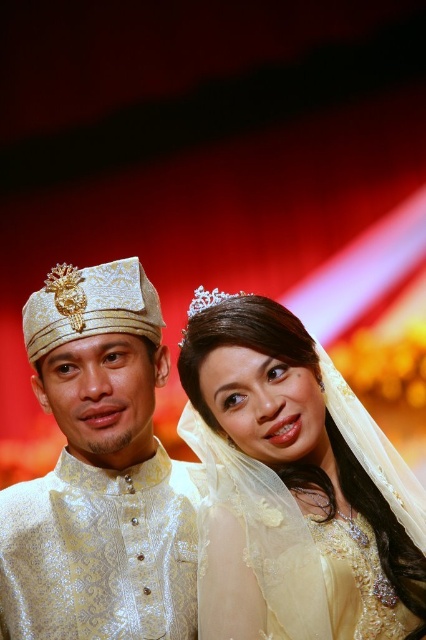
Question: Is white brocade hat at upper left further to camera compared to clear crystal tiara at upper center?

Choices:
 (A) no
 (B) yes

Answer: (A)

Question: In this image, where is matte gold veil at center located relative to clear crystal tiara at center?

Choices:
 (A) right
 (B) left

Answer: (A)

Question: Which point appears farthest from the camera in this image?

Choices:
 (A) (192, 312)
 (B) (158, 566)

Answer: (B)

Question: Which of the following is the closest to the observer?

Choices:
 (A) (187, 310)
 (B) (291, 452)
 (C) (112, 513)
 (D) (181, 348)

Answer: (B)

Question: Which point is farther to the camera?

Choices:
 (A) (313, 584)
 (B) (195, 307)
 (C) (227, 296)

Answer: (B)

Question: Can you confirm if matte gold veil at center is thinner than clear crystal tiara at upper center?

Choices:
 (A) no
 (B) yes

Answer: (A)